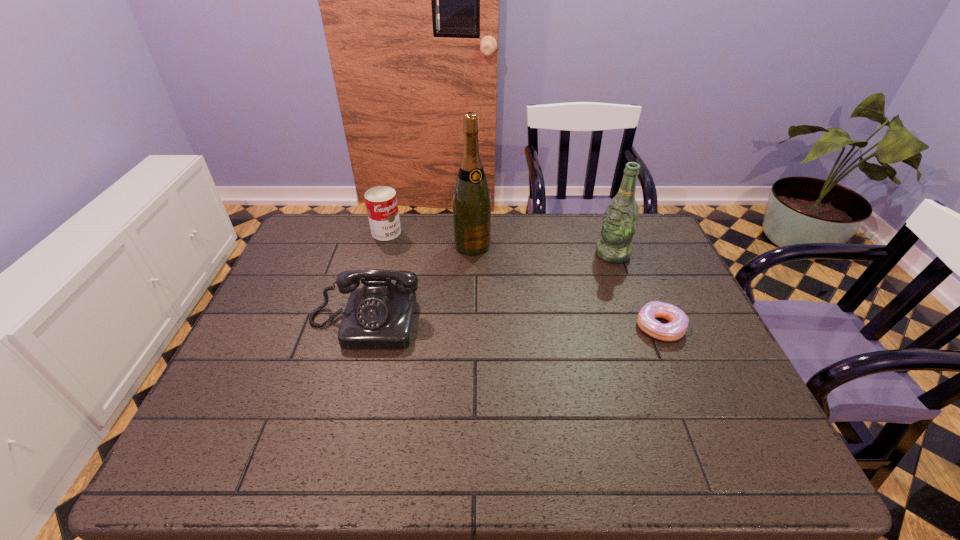
Locate an element on the screen. The image size is (960, 540). free region located 0.390m on the surface of the beer bottle is located at coordinates (504, 319).

Identify the location of vacant space situated on the front label of the can. (451, 303).

Find the location of `vacant point located on the front label of the can`. vacant point located on the front label of the can is located at coordinates (407, 255).

Locate an element on the screen. This screenshot has height=540, width=960. blank space located on the front label of the can is located at coordinates (449, 301).

Identify the location of vacant region located 0.130m on the front-facing side of the third object from right to left. (498, 281).

Where is `vacant space situated on the front-facing side of the third object from right to left`? This screenshot has height=540, width=960. vacant space situated on the front-facing side of the third object from right to left is located at coordinates (541, 342).

The height and width of the screenshot is (540, 960). I want to click on vacant space located on the front-facing side of the third object from right to left, so click(x=501, y=285).

What are the coordinates of `beer bottle that is at the far edge` in the screenshot? It's located at (620, 219).

You are a GUI agent. You are given a task and a screenshot of the screen. Output one action in this format:
    pyautogui.click(x=<x>, y=<y>)
    Task: Click on the can situated at the far edge
    
    Given the screenshot: What is the action you would take?
    pyautogui.click(x=381, y=202)

At what (x,y) coordinates should I click in order to perform the action: click on wine bottle situated at the far edge. Please return your answer as a coordinate pair (x, y). Image resolution: width=960 pixels, height=540 pixels. Looking at the image, I should click on (471, 199).